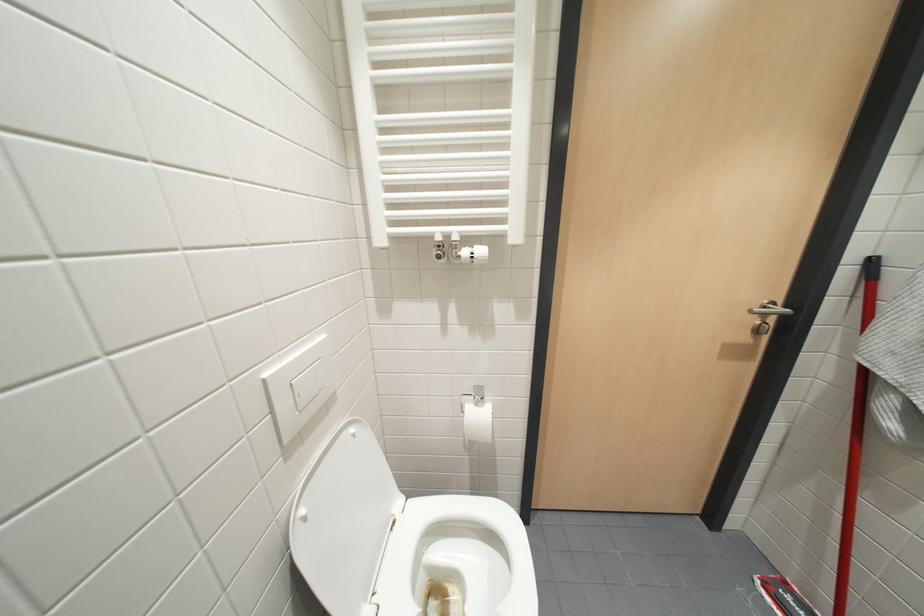
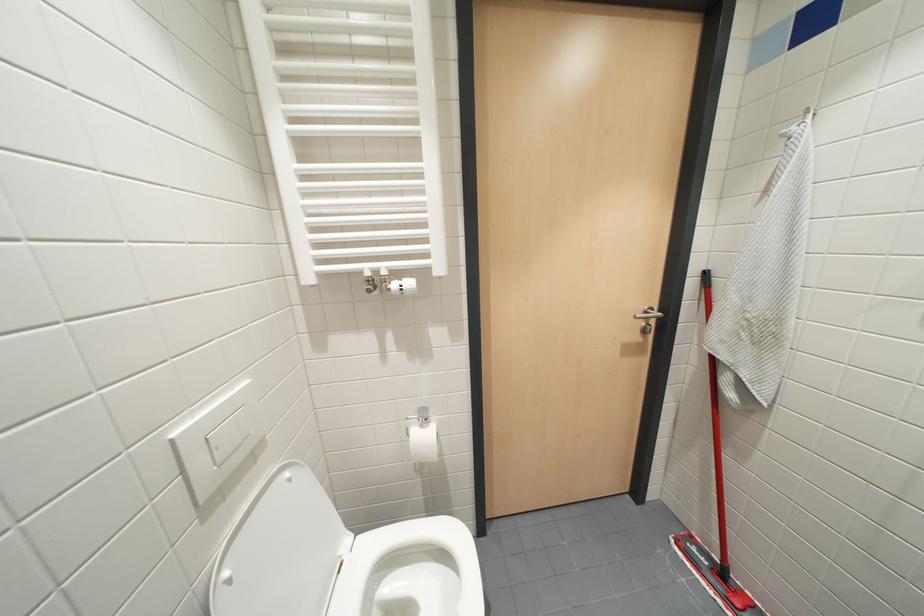
Question: How did the camera likely rotate?

Choices:
 (A) Left
 (B) Right
 (C) Up
 (D) Down

Answer: (B)